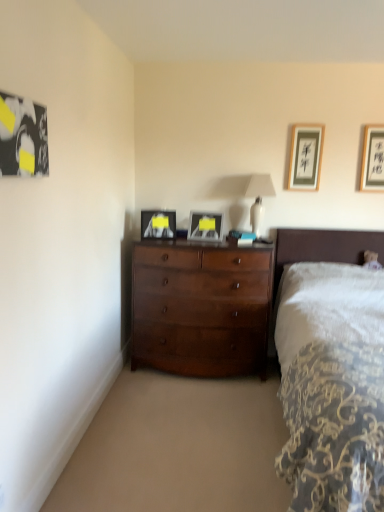
Question: Is shiny brown dresser at center at the right side of matte black picture frame at center, placed as the 4th picture frame when sorted from right to left?

Choices:
 (A) no
 (B) yes

Answer: (B)

Question: Is shiny brown dresser at center smaller than matte black picture frame at center, marked as the 3th picture frame in a back-to-front arrangement?

Choices:
 (A) no
 (B) yes

Answer: (A)

Question: Is matte black picture frame at center, placed as the 4th picture frame when sorted from right to left, located within shiny brown dresser at center?

Choices:
 (A) no
 (B) yes

Answer: (A)

Question: Is shiny brown dresser at center in front of matte black picture frame at center, marked as the 3th picture frame in a back-to-front arrangement?

Choices:
 (A) yes
 (B) no

Answer: (A)

Question: Is shiny brown dresser at center at the left side of matte black picture frame at center, which is counted as the second picture frame, starting from the left?

Choices:
 (A) yes
 (B) no

Answer: (B)

Question: Is point (258, 176) closer or farther from the camera than point (294, 152)?

Choices:
 (A) farther
 (B) closer

Answer: (B)

Question: From a real-world perspective, is white glossy table lamp at upper center positioned above or below matte black picture frame at upper right, which is the fifth picture frame from front to back?

Choices:
 (A) below
 (B) above

Answer: (A)

Question: From the image's perspective, relative to matte black picture frame at upper right, the 4th picture frame in the left-to-right sequence, is white glossy table lamp at upper center above or below?

Choices:
 (A) above
 (B) below

Answer: (B)

Question: In the image, is white glossy table lamp at upper center on the left side or the right side of matte black picture frame at upper right, which ranks as the first picture frame in back-to-front order?

Choices:
 (A) right
 (B) left

Answer: (B)

Question: Considering their positions, is white glossy table lamp at upper center located in front of or behind matte black picture frame at center, marked as the 3th picture frame in a back-to-front arrangement?

Choices:
 (A) behind
 (B) front

Answer: (A)

Question: Would you say white glossy table lamp at upper center is to the left or to the right of matte black picture frame at center, which ranks as the third picture frame in front-to-back order, in the picture?

Choices:
 (A) right
 (B) left

Answer: (A)

Question: Which is correct: white glossy table lamp at upper center is inside matte black picture frame at center, placed as the 4th picture frame when sorted from right to left, or outside of it?

Choices:
 (A) inside
 (B) outside

Answer: (B)

Question: In terms of size, does white glossy table lamp at upper center appear bigger or smaller than matte black picture frame at center, which is counted as the second picture frame, starting from the left?

Choices:
 (A) small
 (B) big

Answer: (B)

Question: Is shiny brown dresser at center inside or outside of black wood picture frame at upper right, positioned as the 4th picture frame in front-to-back order?

Choices:
 (A) outside
 (B) inside

Answer: (A)

Question: Is shiny brown dresser at center wider or thinner than black wood picture frame at upper right, the second picture frame from the back?

Choices:
 (A) thin
 (B) wide

Answer: (B)